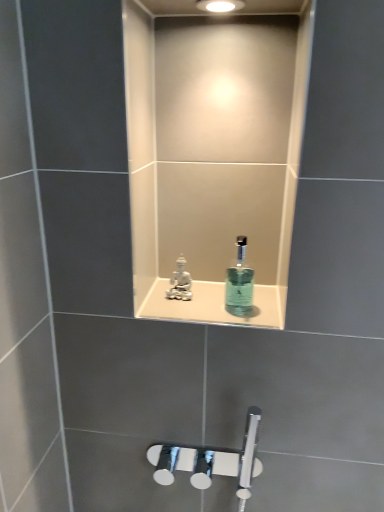
What is the approximate width of white glossy statue at center?

8.53 inches.

The image size is (384, 512). What are the coordinates of `translucent glass mouthwash at center` in the screenshot? It's located at (239, 283).

Considering the sizes of objects translucent glass mouthwash at center and white porcelain figurine at center in the image provided, who is bigger, translucent glass mouthwash at center or white porcelain figurine at center?

With larger size is translucent glass mouthwash at center.

From a real-world perspective, between translucent glass mouthwash at center and white porcelain figurine at center, who is vertically lower?

From a 3D spatial view, white porcelain figurine at center is below.

Which is closer, (x=238, y=267) or (x=172, y=298)?

Positioned in front is point (x=172, y=298).

Which is more to the left, translucent glass mouthwash at center or white porcelain figurine at center?

From the viewer's perspective, white porcelain figurine at center appears more on the left side.

Based on the photo, who is taller, white glossy statue at center or translucent glass mouthwash at center?

Standing taller between the two is translucent glass mouthwash at center.

In the scene shown: How different are the orientations of white glossy statue at center and translucent glass mouthwash at center in degrees?

0.158 degrees.

Can you confirm if white glossy statue at center is positioned to the right of translucent glass mouthwash at center?

No, white glossy statue at center is not to the right of translucent glass mouthwash at center.

How distant is white glossy statue at center from translucent glass mouthwash at center?

white glossy statue at center is 4.81 centimeters from translucent glass mouthwash at center.

Would you say white porcelain figurine at center is inside or outside translucent glass mouthwash at center?

The correct answer is: outside.

From a real-world perspective, which object rests below the other?

From a 3D spatial view, white porcelain figurine at center is below.

Between point (176, 298) and point (245, 249), which one is positioned in front?

The point (176, 298) is in front.

Can you see white porcelain figurine at center touching translucent glass mouthwash at center?

No, white porcelain figurine at center is not beside translucent glass mouthwash at center.

Between white porcelain figurine at center and white glossy statue at center, which one has larger size?

white glossy statue at center.

Is there a large distance between white porcelain figurine at center and white glossy statue at center?

No, white porcelain figurine at center is in close proximity to white glossy statue at center.

How many degrees apart are the facing directions of white porcelain figurine at center and white glossy statue at center?

They differ by 1.02 degrees in their facing directions.

Looking at their sizes, would you say white porcelain figurine at center is wider or thinner than white glossy statue at center?

white porcelain figurine at center is thinner than white glossy statue at center.

Based on the photo, is white glossy statue at center smaller than white porcelain figurine at center?

No, white glossy statue at center is not smaller than white porcelain figurine at center.

Which of these two, white glossy statue at center or white porcelain figurine at center, is wider?

white glossy statue at center is wider.

Considering the sizes of white glossy statue at center and white porcelain figurine at center in the image, is white glossy statue at center taller or shorter than white porcelain figurine at center?

In the image, white glossy statue at center appears to be shorter than white porcelain figurine at center.

Where is `sink below the white porcelain figurine at center (from the image's perspective)`? Image resolution: width=384 pixels, height=512 pixels. sink below the white porcelain figurine at center (from the image's perspective) is located at coordinates (218, 298).

Looking at their sizes, would you say translucent glass mouthwash at center is wider or thinner than white glossy statue at center?

Clearly, translucent glass mouthwash at center has less width compared to white glossy statue at center.

Considering the points (253, 275) and (276, 312), which point is in front, point (253, 275) or point (276, 312)?

The point (276, 312) is in front.

From the image's perspective, is translucent glass mouthwash at center located above or below white glossy statue at center?

From the image's perspective, translucent glass mouthwash at center appears above white glossy statue at center.

Based on their positions, is translucent glass mouthwash at center located to the left or right of white glossy statue at center?

translucent glass mouthwash at center is to the right of white glossy statue at center.

Find the location of a particular element. tap that appears behind the translucent glass mouthwash at center is located at coordinates (180, 282).

Image resolution: width=384 pixels, height=512 pixels. In order to click on mouthwash in front of the white glossy statue at center in this screenshot , I will do `click(239, 283)`.

From the image, which object appears to be nearer to translucent glass mouthwash at center, white glossy statue at center or white porcelain figurine at center?

The object closer to translucent glass mouthwash at center is white glossy statue at center.

Estimate the real-world distances between objects in this image. Which object is further from translucent glass mouthwash at center, white porcelain figurine at center or white glossy statue at center?

white porcelain figurine at center lies further to translucent glass mouthwash at center than the other object.

Which object lies nearer to the anchor point white glossy statue at center, translucent glass mouthwash at center or white porcelain figurine at center?

translucent glass mouthwash at center is closer to white glossy statue at center.

From the image, which object appears to be farther from white porcelain figurine at center, white glossy statue at center or translucent glass mouthwash at center?

Among the two, translucent glass mouthwash at center is located further to white porcelain figurine at center.

Based on their spatial positions, is white porcelain figurine at center or translucent glass mouthwash at center further from white glossy statue at center?

white porcelain figurine at center.

When comparing their distances from white porcelain figurine at center, does translucent glass mouthwash at center or white glossy statue at center seem further?

translucent glass mouthwash at center lies further to white porcelain figurine at center than the other object.

Image resolution: width=384 pixels, height=512 pixels. Identify the location of sink located between white porcelain figurine at center and translucent glass mouthwash at center in the left-right direction. (218, 298).